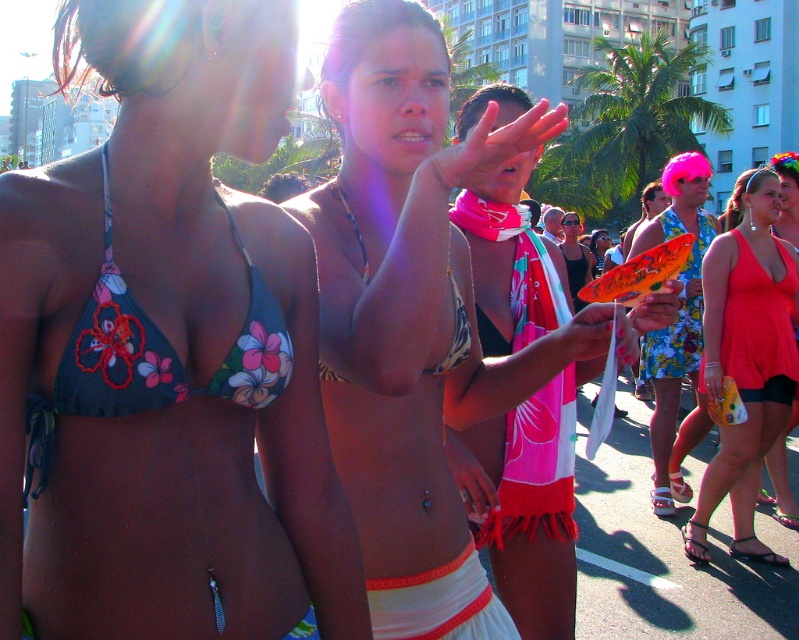
Question: Which of the following is the closest to the observer?

Choices:
 (A) floral print fabric bikini top at left
 (B) floral bikini top at center

Answer: (B)

Question: Which object is positioned farthest from the floral fabric dress at center?

Choices:
 (A) floral bikini top at center
 (B) floral print fabric bikini top at left
 (C) pink fabric scarf at center

Answer: (B)

Question: Is floral print fabric bikini top at left closer to the viewer compared to floral fabric dress at center?

Choices:
 (A) yes
 (B) no

Answer: (A)

Question: Does floral bikini top at center have a lesser width compared to matte black bikini top at center?

Choices:
 (A) no
 (B) yes

Answer: (B)

Question: Is floral bikini top at center positioned in front of pink fabric scarf at center?

Choices:
 (A) yes
 (B) no

Answer: (A)

Question: Based on their relative distances, which object is farther from the matte red tank top at center?

Choices:
 (A) floral print bikini at center
 (B) floral fabric dress at center
 (C) floral bikini top at center

Answer: (C)